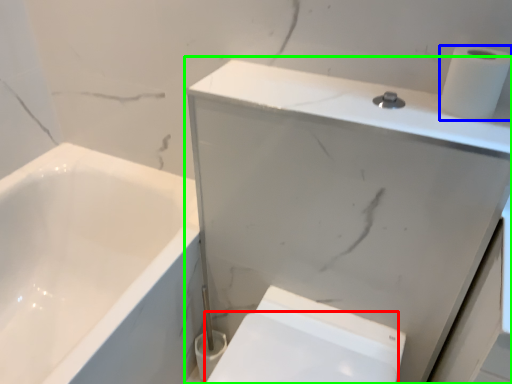
Question: Based on their relative distances, which object is nearer to bidet (highlighted by a red box)? Choose from toilet paper (highlighted by a blue box) and medicine cabinet (highlighted by a green box).

Choices:
 (A) toilet paper
 (B) medicine cabinet

Answer: (B)